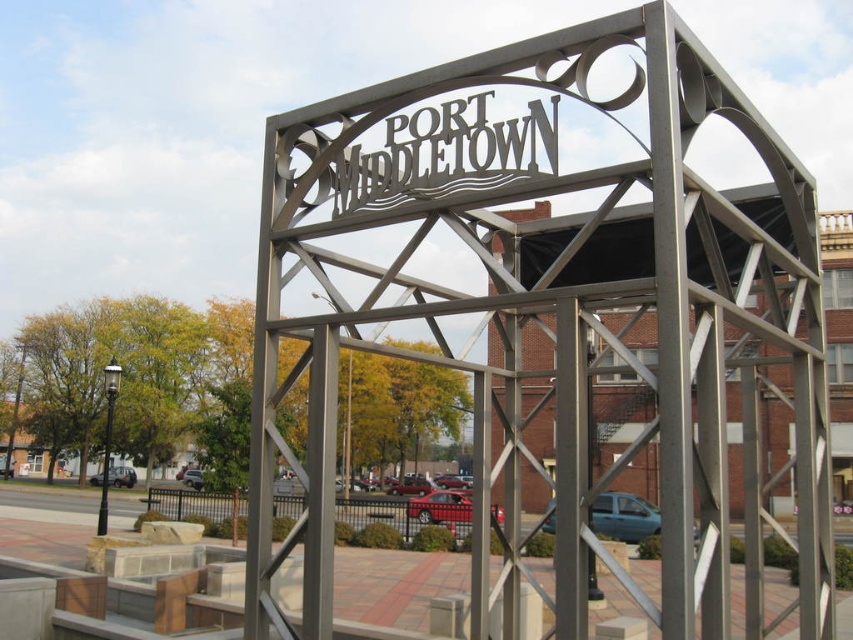
Is teal metallic car at center above metallic red car at center?

Yes.

Is the position of teal metallic car at center less distant than that of metallic red car at center?

Yes.

The image size is (853, 640). Identify the location of teal metallic car at center. (624, 516).

Locate an element on the screen. The width and height of the screenshot is (853, 640). teal metallic car at center is located at coordinates (624, 516).

The height and width of the screenshot is (640, 853). What are the coordinates of `metallic sign at center` in the screenshot? It's located at (445, 154).

Does teal metallic car at center appear under matte black sedan at lower left?

Incorrect, teal metallic car at center is not positioned below matte black sedan at lower left.

Does point (606, 499) come in front of point (123, 477)?

Yes, it is in front of point (123, 477).

Locate an element on the screen. This screenshot has width=853, height=640. teal metallic car at center is located at coordinates (624, 516).